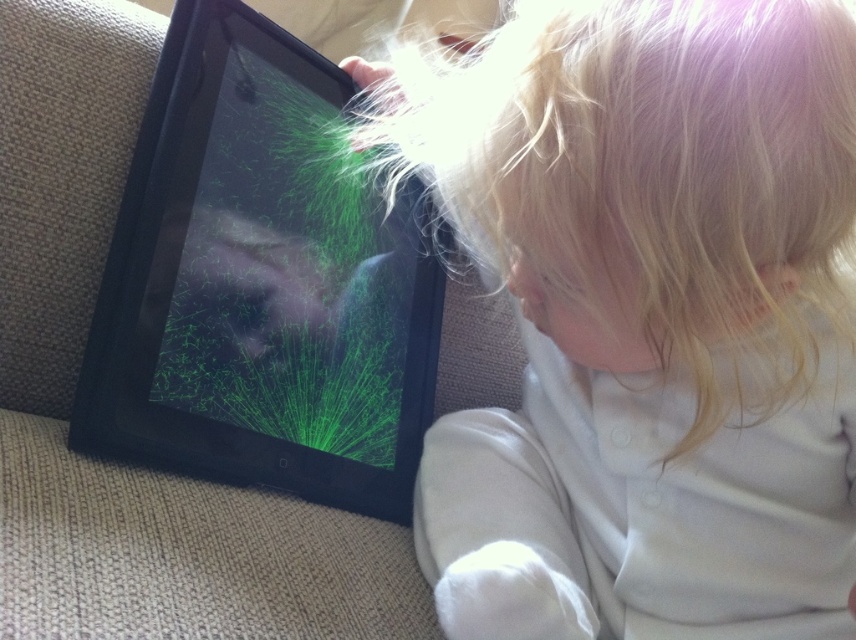
You are a photographer trying to capture the child without the glare from the tablet screen. The glare is located at point (646, 317). To avoid the glare, should you move your camera to the left or right of the child?

The point (646, 317) marks the blonde hair at upper right. To avoid the glare, move your camera to the left side of the child.

From the picture: You are a photographer trying to capture the child and their tablet. You notice the blonde hair at upper right and the black matte tablet at center. Which object is positioned more to the right side of the image?

The blonde hair at upper right is positioned to the right of the black matte tablet at center, so it is more to the right side of the image.

You are a photographer trying to capture a closeup of the child without the tablet obstructing the face. Given the distance between the blonde hair at upper right and the black matte tablet at center, can you adjust your position to frame the shot so that the tablet is not covering the child?

The blonde hair at upper right and the black matte tablet at center are 7.71 inches apart. Since the distance is relatively small, adjusting your position slightly might allow you to frame the shot so the tablet does not cover the child, but it requires careful positioning to ensure the tablet remains visible while the child remains the focus.